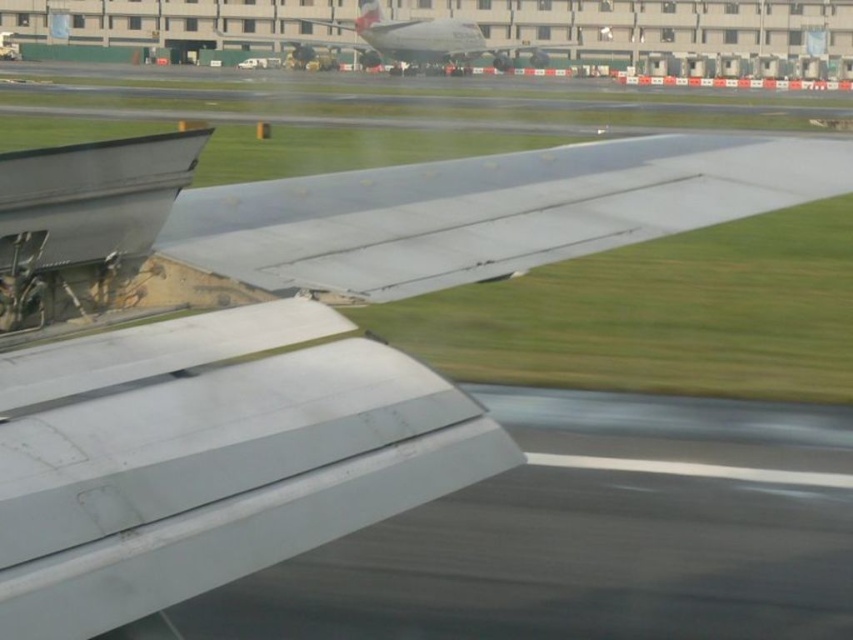
Can you confirm if metallic gray winglet at lower left is positioned above white glossy airplane at center?

No.

Does metallic gray winglet at lower left have a lesser width compared to white glossy airplane at center?

Yes.

This screenshot has width=853, height=640. What do you see at coordinates (219, 477) in the screenshot?
I see `metallic gray winglet at lower left` at bounding box center [219, 477].

You are a GUI agent. You are given a task and a screenshot of the screen. Output one action in this format:
    pyautogui.click(x=<x>, y=<y>)
    Task: Click on the metallic gray winglet at lower left
    This screenshot has height=640, width=853.
    Given the screenshot: What is the action you would take?
    pyautogui.click(x=219, y=477)

In the scene shown: Measure the distance between point (535, 588) and camera.

5.38 meters

Based on the photo, who is positioned more to the right, gray matte tarmac at lower left or metallic gray winglet at lower left?

Positioned to the right is gray matte tarmac at lower left.

Between point (802, 548) and point (151, 506), which one is positioned in front?

Point (151, 506)

Find the location of a particular element. The width and height of the screenshot is (853, 640). gray matte tarmac at lower left is located at coordinates (590, 534).

Which is below, gray matte tarmac at lower left or white glossy airplane at center?

Positioned lower is gray matte tarmac at lower left.

Can you confirm if gray matte tarmac at lower left is positioned above white glossy airplane at center?

No, gray matte tarmac at lower left is not above white glossy airplane at center.

Image resolution: width=853 pixels, height=640 pixels. I want to click on gray matte tarmac at lower left, so click(590, 534).